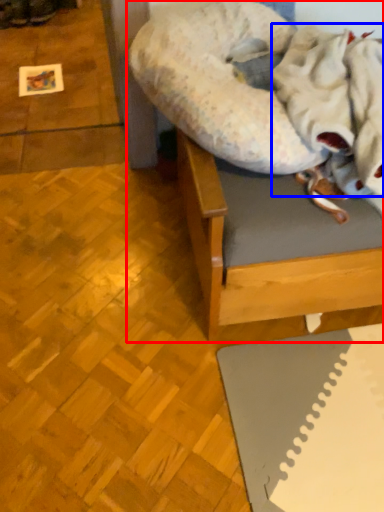
Question: Which of the following is the closest to the observer, furniture (highlighted by a red box) or blanket (highlighted by a blue box)?

Choices:
 (A) furniture
 (B) blanket

Answer: (B)